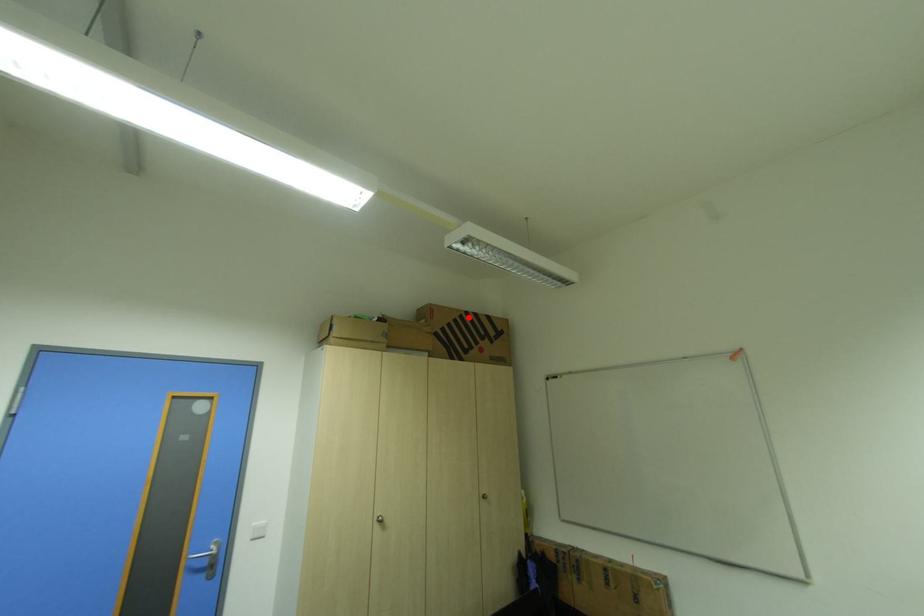
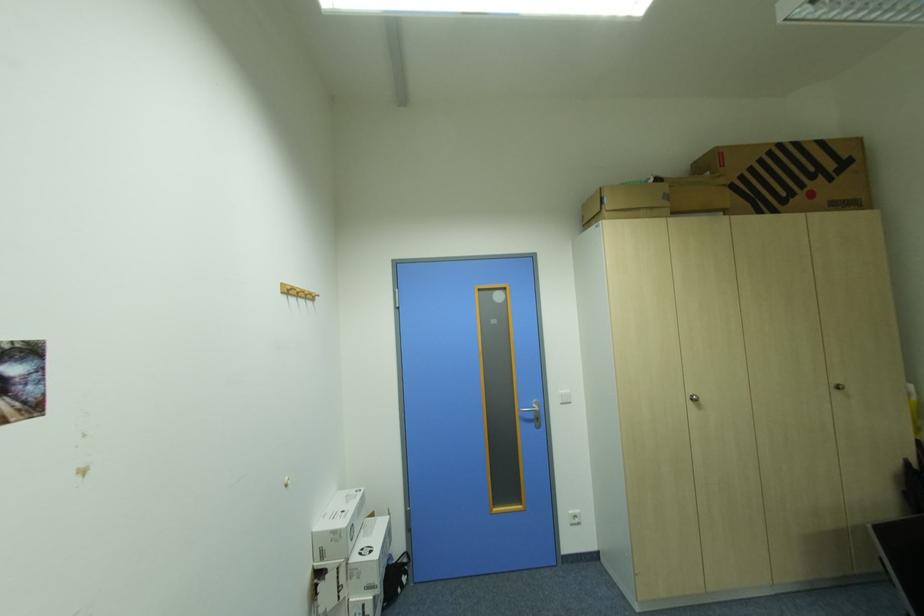
In the second image, find the point that corresponds to the highlighted location in the first image.

(777, 153)